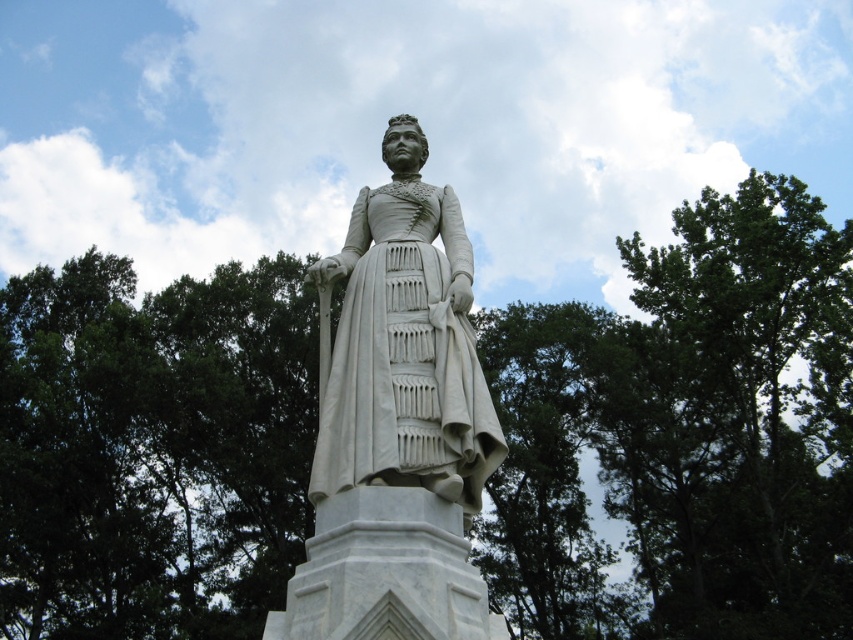
From the picture: You are a photographer planning to take a portrait of the white marble statue at center. You want to ensure the green leafy tree at center doesn

Answer: The green leafy tree at center is much taller than the white marble statue at center, so it will likely overshadow the statue in the portrait unless you adjust your angle or position to frame the statue more prominently.

You are a painter setting up an easel to paint the scene. You want to ensure your canvas can capture both the green leafy tree at center and the white marble statue at center. Based on their widths, which object should you consider the width of when choosing your canvas size?

The green leafy tree at center might be wider than the white marble statue at center, so you should consider the width of the green leafy tree at center when choosing your canvas size to ensure both fit properly.